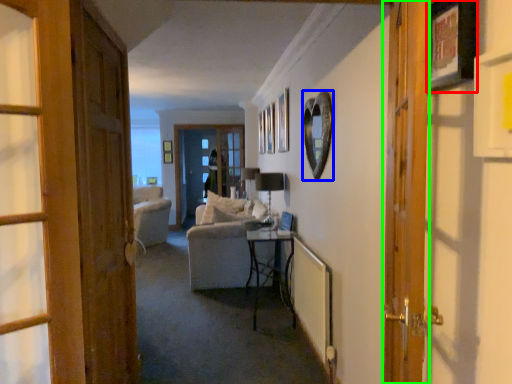
Question: Considering the real-world distances, which object is closest to picture frame (highlighted by a red box)? picture frame (highlighted by a blue box) or door (highlighted by a green box).

Choices:
 (A) picture frame
 (B) door

Answer: (B)